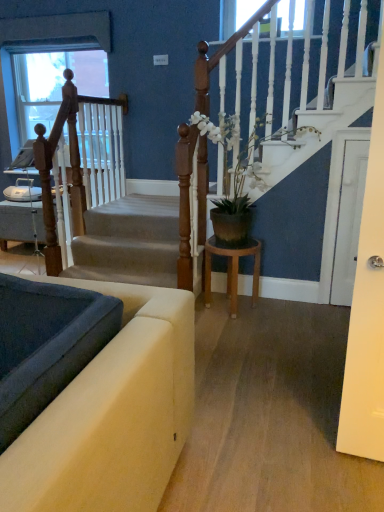
This screenshot has height=512, width=384. Find the location of `vacant space that is to the left of white glossy door at right`. vacant space that is to the left of white glossy door at right is located at coordinates (320, 308).